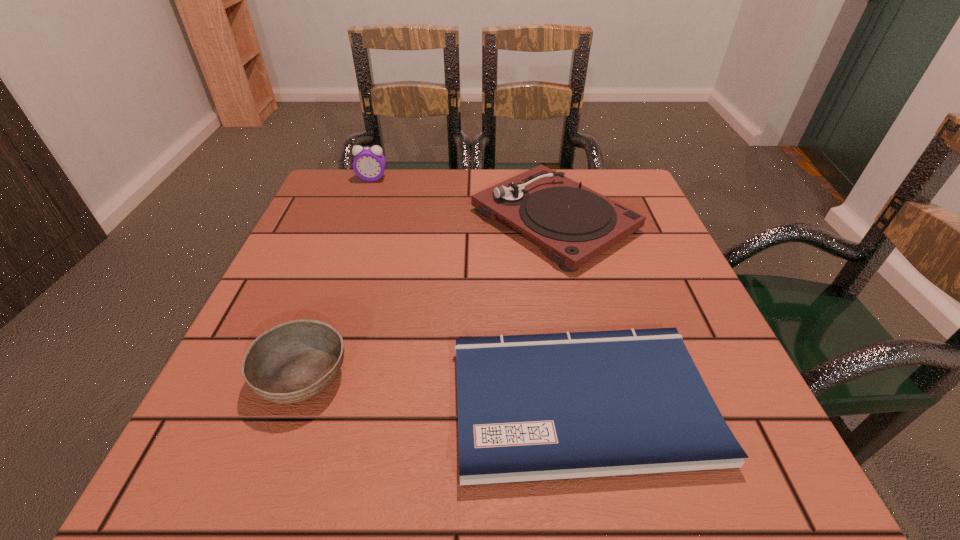
The image size is (960, 540). Identify the location of object positioned at the near edge. (536, 407).

Locate an element on the screen. alarm clock located in the left edge section of the desktop is located at coordinates (369, 164).

The height and width of the screenshot is (540, 960). I want to click on bowl that is at the left edge, so click(x=294, y=361).

Where is `phonograph_record that is positioned at the right edge`? The image size is (960, 540). phonograph_record that is positioned at the right edge is located at coordinates (575, 224).

Locate an element on the screen. This screenshot has width=960, height=540. paperback book that is at the right edge is located at coordinates (536, 407).

I want to click on object that is at the far left corner, so click(369, 164).

This screenshot has height=540, width=960. I want to click on object at the far right corner, so click(575, 224).

This screenshot has width=960, height=540. In order to click on object at the near right corner in this screenshot , I will do `click(536, 407)`.

Where is `vacant space at the far edge`? This screenshot has height=540, width=960. vacant space at the far edge is located at coordinates (427, 201).

Identify the location of blank space at the near edge of the desktop. This screenshot has height=540, width=960. (301, 478).